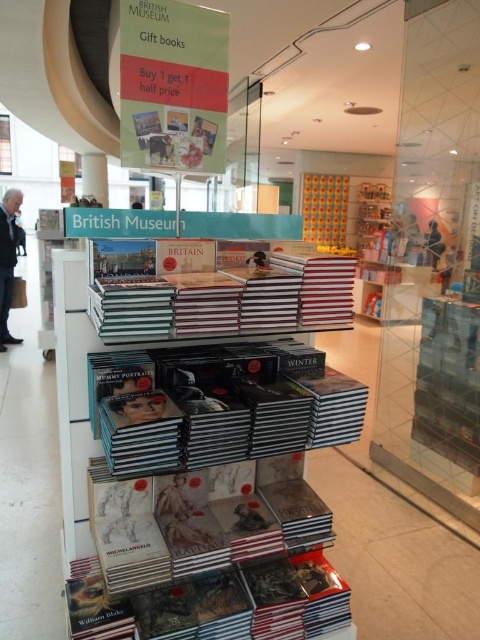
You are standing in front of the British Museum display stand and see the white matte book at center. If you want to pick it up, will you be able to reach it without moving closer?

The white matte book at center is 3.48 feet away from the viewer, which is approximately 42 inches. Since the average human arm length is about 25 to 30 inches, you would need to move closer to reach it.

You are standing in the bookstore and want to reach the promotional sign above the British Museum display stand. You notice two points marked on the floor, one at point (x=287, y=520) and the other at point (x=202, y=452). Which point is closer to the sign?

Point (x=202, y=452) is closer to the promotional sign because it is in front of point (x=287, y=520). Since the sign is above the display stand, the point closer to the front would be nearer to the sign.

You are organizing a display for the British Museum gift books. You have a white matte book at center and a hardcover book at center. Which book is wider?

The white matte book at center is wider than the hardcover book at center.